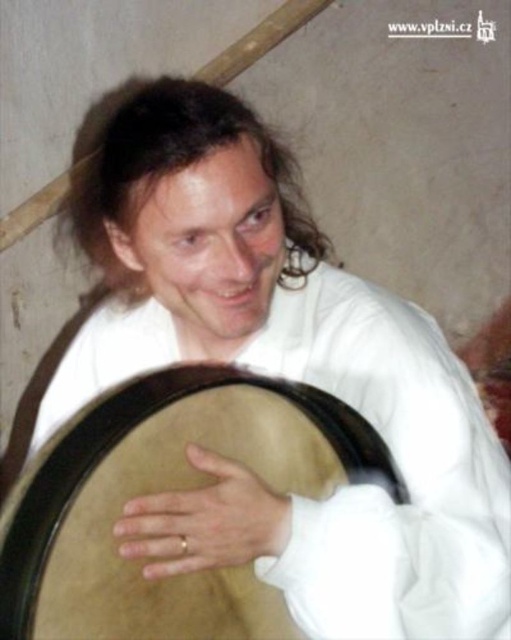
Who is positioned more to the right, light brown leather drum at lower center or gold ring at center?

gold ring at center

Consider the image. Measure the distance between light brown leather drum at lower center and camera.

The distance of light brown leather drum at lower center from camera is 26.32 inches.

Find the location of a particular element. The image size is (511, 640). light brown leather drum at lower center is located at coordinates (166, 490).